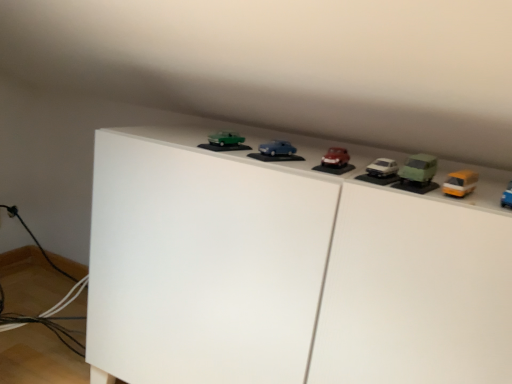
Question: Does white matte cabinet at upper center have a greater width compared to matte blue car at center, the 2th toy from the left?

Choices:
 (A) no
 (B) yes

Answer: (B)

Question: From a real-world perspective, is white matte cabinet at upper center physically above matte blue car at center, the 2th toy from the left?

Choices:
 (A) yes
 (B) no

Answer: (B)

Question: From the image's perspective, is white matte cabinet at upper center located above matte blue car at center, the 2th toy from the left?

Choices:
 (A) no
 (B) yes

Answer: (A)

Question: Considering the relative sizes of white matte cabinet at upper center and matte blue car at center, which is the 4th toy in right-to-left order, in the image provided, is white matte cabinet at upper center taller than matte blue car at center, which is the 4th toy in right-to-left order,?

Choices:
 (A) no
 (B) yes

Answer: (B)

Question: Is white matte cabinet at upper center shorter than matte blue car at center, which is the 4th toy in right-to-left order?

Choices:
 (A) no
 (B) yes

Answer: (A)

Question: In terms of size, does matte blue car at center, which is the 4th toy in right-to-left order, appear bigger or smaller than green matte car at right, marked as the 4th toy in a left-to-right arrangement?

Choices:
 (A) big
 (B) small

Answer: (B)

Question: In the image, is matte blue car at center, which is the 4th toy in right-to-left order, on the left side or the right side of green matte car at right, marked as the 4th toy in a left-to-right arrangement?

Choices:
 (A) right
 (B) left

Answer: (B)

Question: Is point (288, 145) positioned closer to the camera than point (410, 177)?

Choices:
 (A) farther
 (B) closer

Answer: (A)

Question: Is matte blue car at center, the 2th toy from the left, taller or shorter than green matte car at right, marked as the 4th toy in a left-to-right arrangement?

Choices:
 (A) short
 (B) tall

Answer: (A)

Question: Is point click(422, 190) positioned closer to the camera than point click(466, 190)?

Choices:
 (A) closer
 (B) farther

Answer: (A)

Question: From a real-world perspective, is green matte car at right, marked as the 4th toy in a left-to-right arrangement, positioned above or below yellow matte van at upper right, the first toy from the right?

Choices:
 (A) above
 (B) below

Answer: (A)

Question: In terms of height, does green matte car at right, marked as the 4th toy in a left-to-right arrangement, look taller or shorter compared to yellow matte van at upper right, the first toy from the right?

Choices:
 (A) short
 (B) tall

Answer: (B)

Question: Would you say green matte car at right, marked as the 4th toy in a left-to-right arrangement, is to the left or to the right of yellow matte van at upper right, the fifth toy viewed from the left, in the picture?

Choices:
 (A) left
 (B) right

Answer: (A)

Question: In the image, is green matte car at upper center, the fifth toy positioned from the right, on the left side or the right side of white matte cabinet at upper center?

Choices:
 (A) right
 (B) left

Answer: (B)

Question: Looking at their shapes, would you say green matte car at upper center, which ranks as the 1th toy in left-to-right order, is wider or thinner than white matte cabinet at upper center?

Choices:
 (A) wide
 (B) thin

Answer: (B)